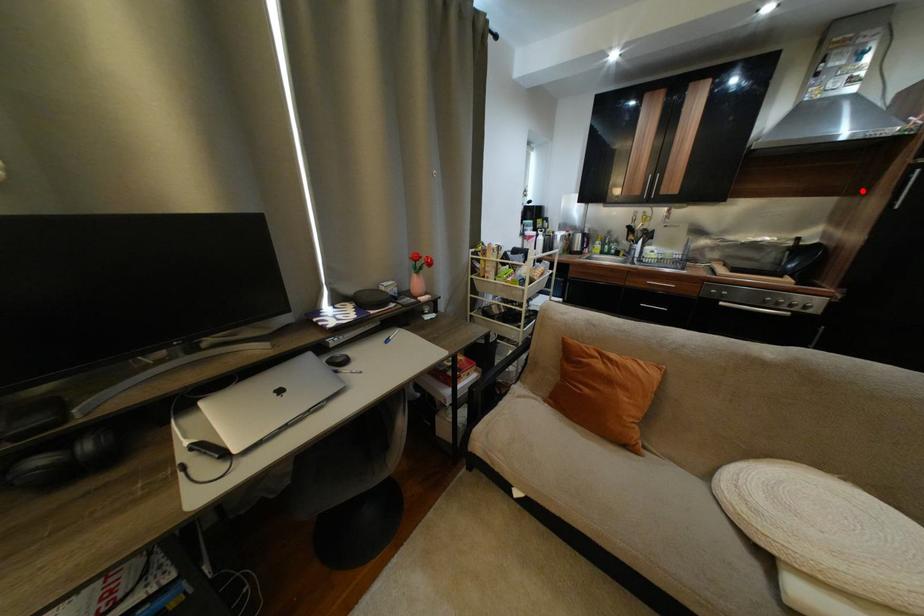
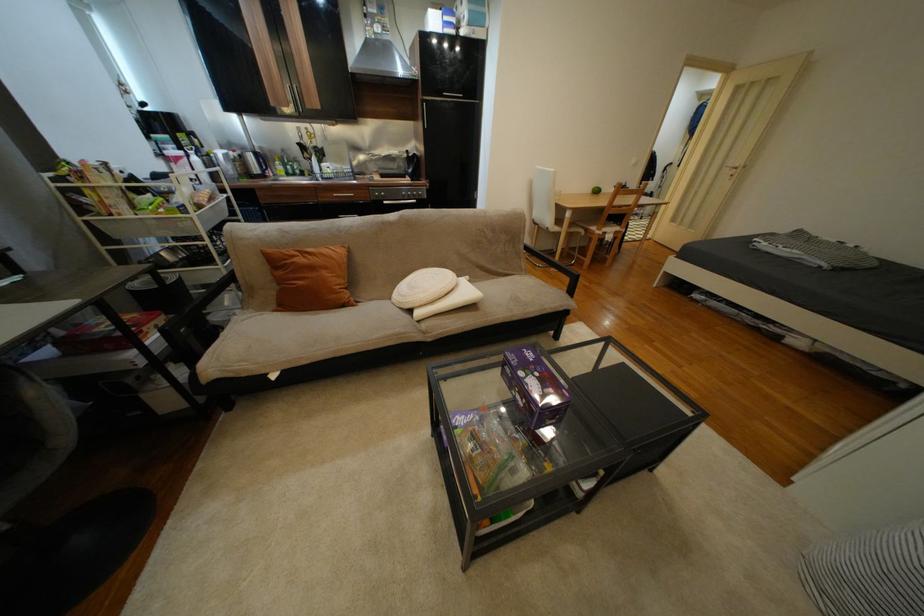
Question: I am providing you with two images of the same scene from different viewpoints. Image1 has a red point marked. In image2, the corresponding 3D location appears at what relative position? Reply with the corresponding letter.

Choices:
 (A) Closer
 (B) Farther

Answer: (A)